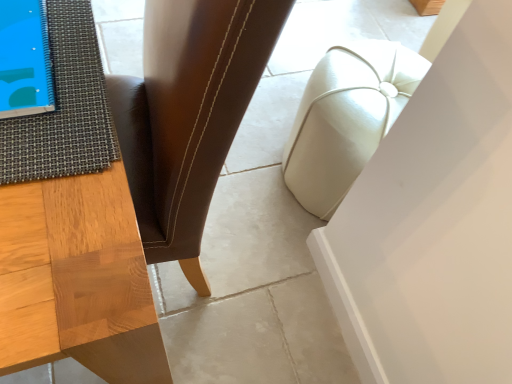
Question: Is textured gray mat at left taller or shorter than white leather ottoman at center?

Choices:
 (A) tall
 (B) short

Answer: (B)

Question: Considering the positions of textured gray mat at left and white leather ottoman at center in the image, is textured gray mat at left wider or thinner than white leather ottoman at center?

Choices:
 (A) wide
 (B) thin

Answer: (A)

Question: Estimate the real-world distances between objects in this image. Which object is farther from the white leather ottoman at center?

Choices:
 (A) textured gray mat at left
 (B) brown leather chair at center

Answer: (A)

Question: Which is nearer to the textured gray mat at left?

Choices:
 (A) white leather ottoman at center
 (B) brown leather chair at center

Answer: (B)